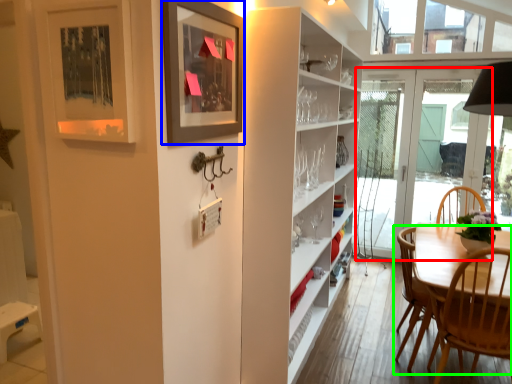
Question: Based on their relative distances, which object is farther from door (highlighted by a red box)? Choose from picture frame (highlighted by a blue box) and chair (highlighted by a green box).

Choices:
 (A) picture frame
 (B) chair

Answer: (A)